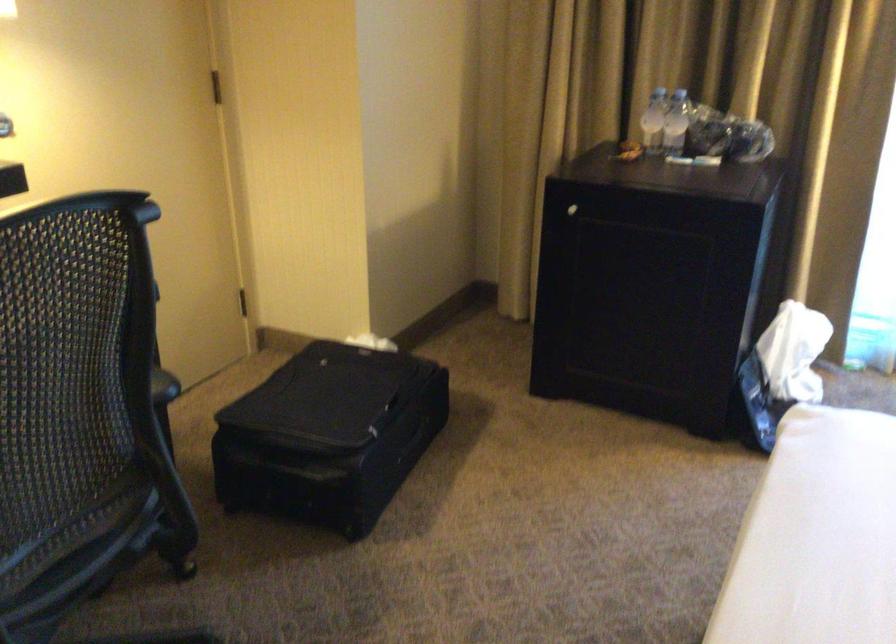
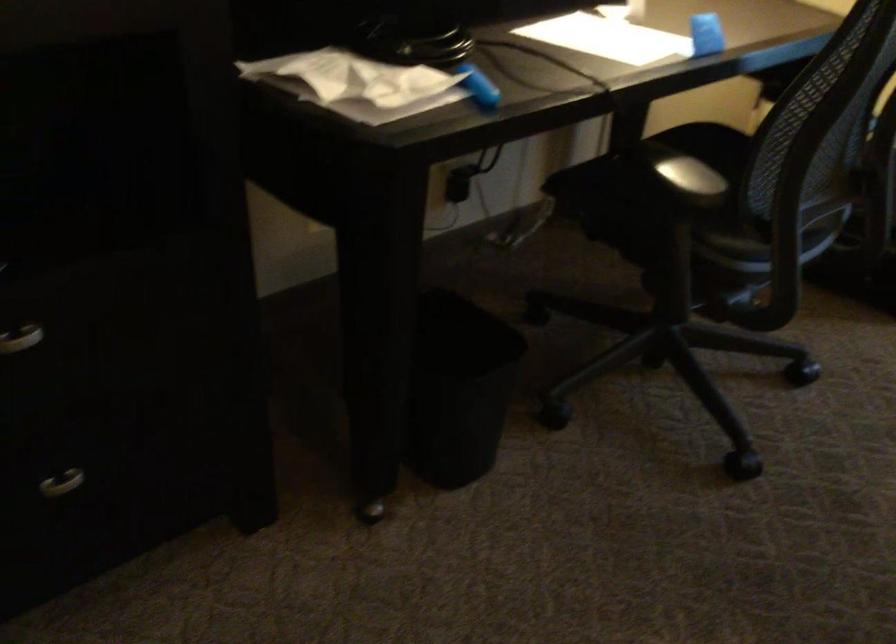
In a continuous first-person perspective shot, in which direction is the camera moving?

The cameraman moved toward left, backward.